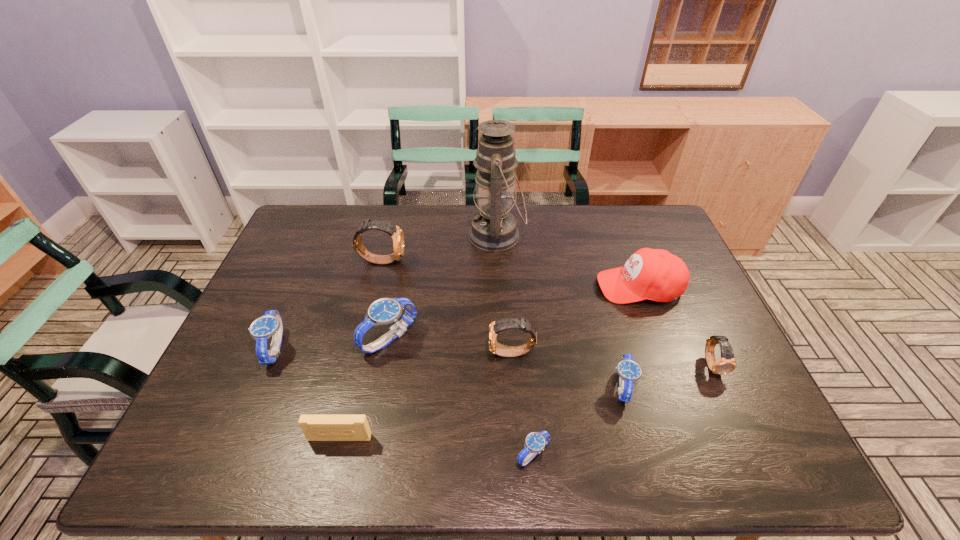
Where is `videotape`? videotape is located at coordinates tap(315, 427).

The width and height of the screenshot is (960, 540). What are the coordinates of `the second shortest watch` in the screenshot? It's located at (629, 372).

Locate an element on the screen. This screenshot has width=960, height=540. the second smallest blue watch is located at coordinates (629, 372).

Locate an element on the screen. the shortest object is located at coordinates 535,441.

At what (x,y) coordinates should I click in order to perform the action: click on the second blue watch from right to left. Please return your answer as a coordinate pair (x, y). Looking at the image, I should click on (535, 441).

The height and width of the screenshot is (540, 960). In order to click on free space located 0.150m on the right of the tallest object in this screenshot , I will do `click(569, 235)`.

Where is `free location located 0.120m on the face of the farthest gold watch`? free location located 0.120m on the face of the farthest gold watch is located at coordinates (443, 260).

This screenshot has width=960, height=540. I want to click on free space located 0.260m on the front panel of the baseball cap, so click(x=510, y=287).

The width and height of the screenshot is (960, 540). I want to click on free region located on the front panel of the baseball cap, so click(x=547, y=287).

Where is `vacant space located on the front panel of the baseball cap`? vacant space located on the front panel of the baseball cap is located at coordinates (534, 287).